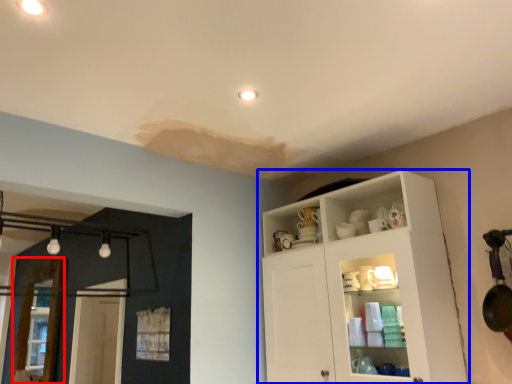
Question: Which object appears closest to the camera in this image, screen door (highlighted by a red box) or cupboard (highlighted by a blue box)?

Choices:
 (A) screen door
 (B) cupboard

Answer: (B)